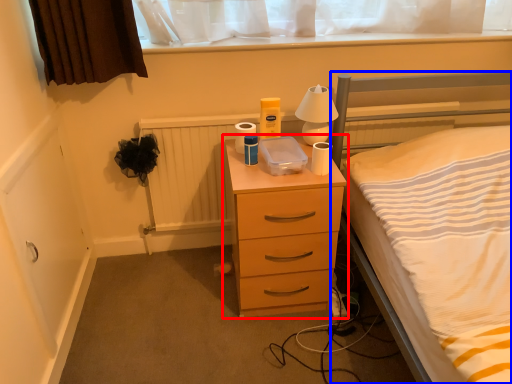
Question: Which object appears closest to the camera in this image, chest of drawers (highlighted by a red box) or bed (highlighted by a blue box)?

Choices:
 (A) chest of drawers
 (B) bed

Answer: (B)